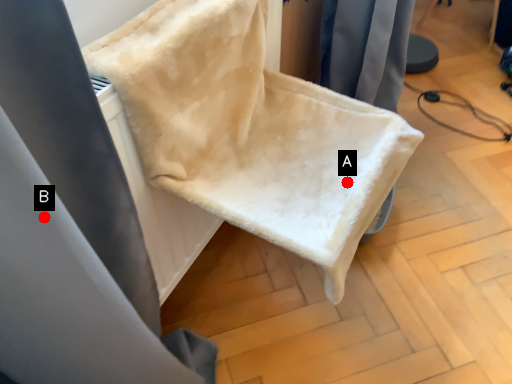
Question: Two points are circled on the image, labeled by A and B beside each circle. Among these points, which one is farthest from the camera?

Choices:
 (A) A is further
 (B) B is further

Answer: (A)